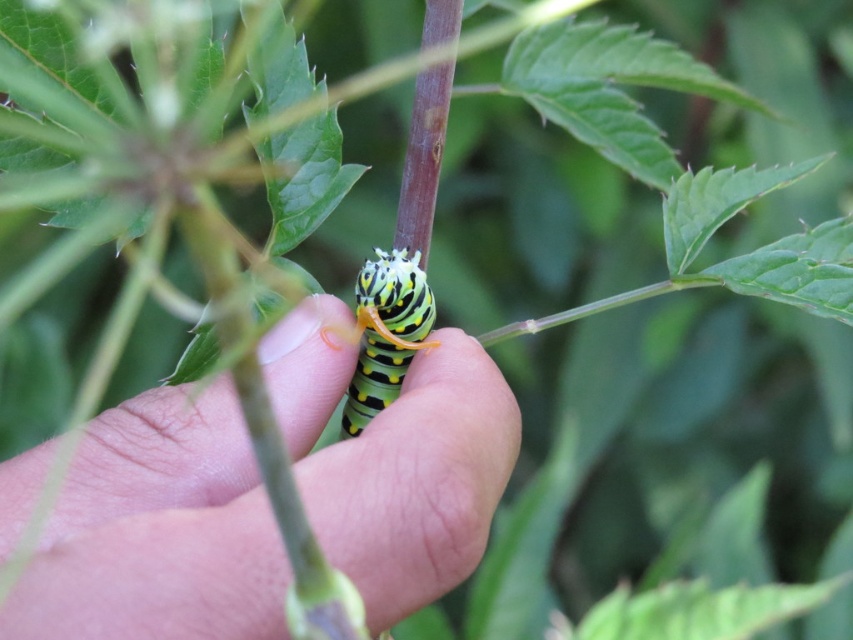
You are a researcher studying the positioning of insects in natural settings. You observe the image and need to record the exact coordinates of the green matte caterpillar at center. What are its coordinates?

The green matte caterpillar at center is located at coordinates point (157,531).